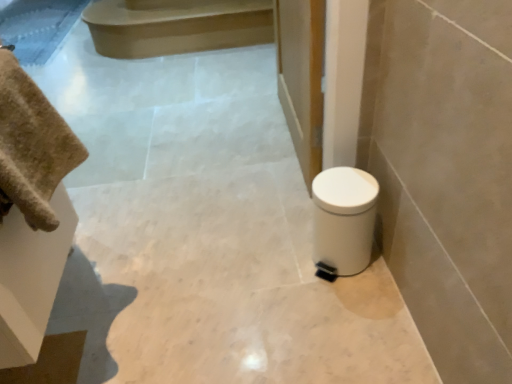
Where is `free spot behind white plastic toilet at lower right`? The image size is (512, 384). free spot behind white plastic toilet at lower right is located at coordinates (294, 221).